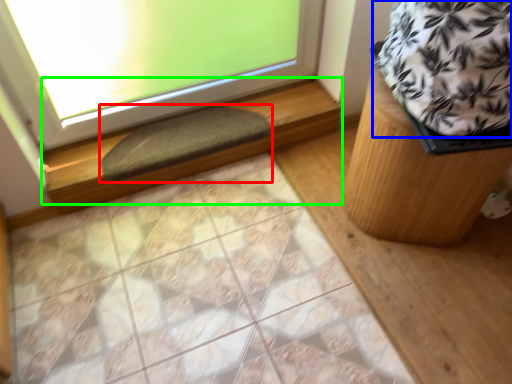
Question: Which is farther away from doormat (highlighted by a red box)? blanket (highlighted by a blue box) or window sill (highlighted by a green box)?

Choices:
 (A) blanket
 (B) window sill

Answer: (A)